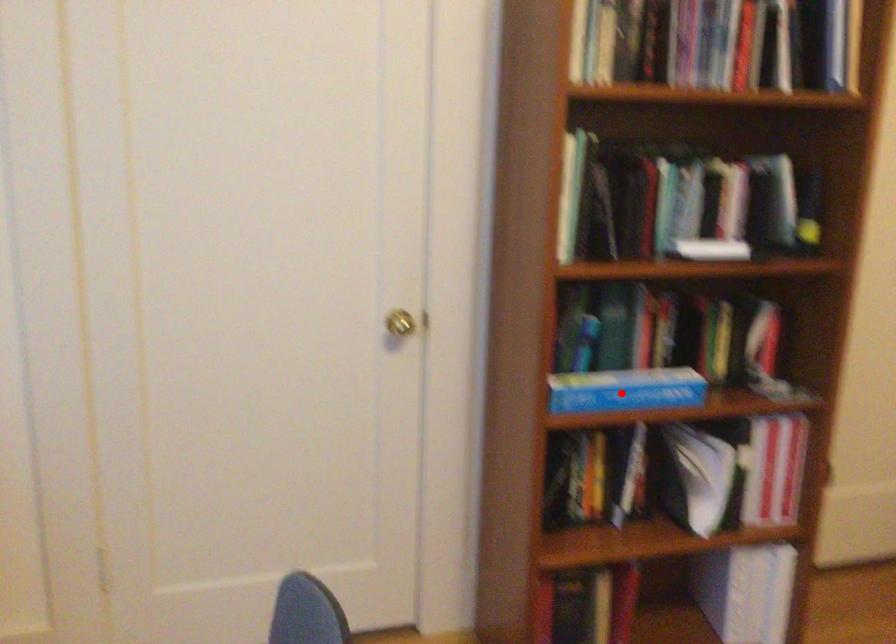
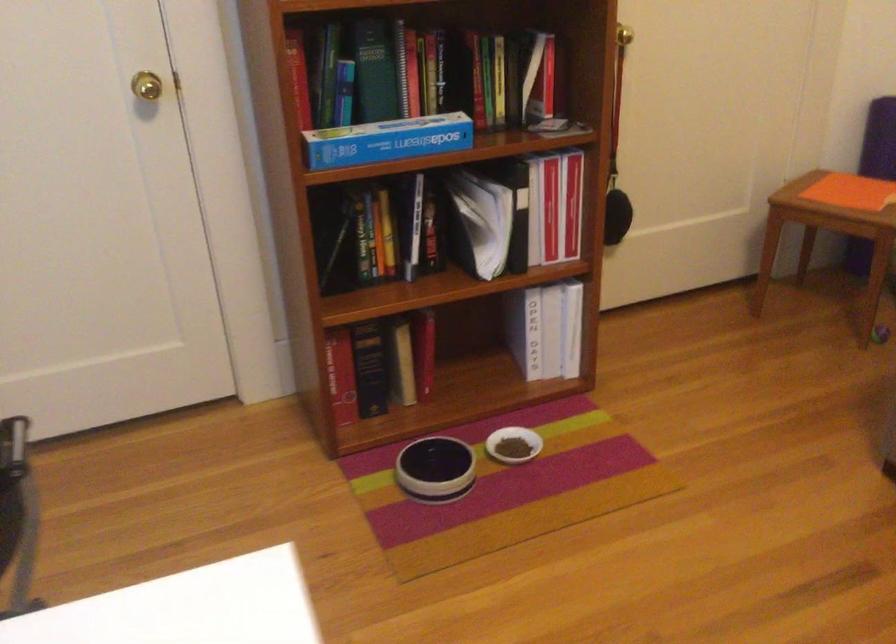
Find the pixel in the second image that matches the highlighted location in the first image.

(386, 140)